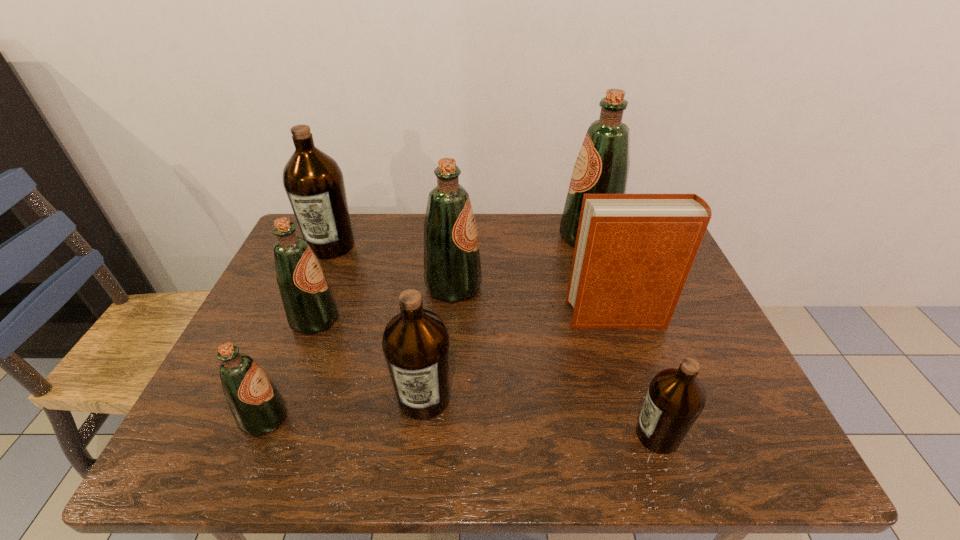
Identify the location of object that ranks as the fifth closest to the second biggest brown olive oil. (675, 398).

I want to click on object that is the sixth closest to the nearest green olive oil, so click(675, 398).

This screenshot has height=540, width=960. In order to click on olive oil that is the sixth closest to the rightmost green olive oil in this screenshot , I will do `click(258, 408)`.

Image resolution: width=960 pixels, height=540 pixels. What are the coordinates of `olive oil that is the sixth nearest to the farthest brown olive oil` in the screenshot? It's located at (675, 398).

This screenshot has width=960, height=540. I want to click on green olive oil that is the closest to the biggest brown olive oil, so click(309, 304).

Locate an element on the screen. the fourth closest green olive oil to the leftmost brown olive oil is located at coordinates point(602,166).

Find the location of `brown olive oil that stands as the second closest to the smallest brown olive oil`. brown olive oil that stands as the second closest to the smallest brown olive oil is located at coordinates (314, 183).

Identify which brown olive oil is located as the second nearest to the second brown olive oil from left to right. Please provide its 2D coordinates. Your answer should be formatted as a tuple, i.e. [(x, y)], where the tuple contains the x and y coordinates of a point satisfying the conditions above.

[(314, 183)]

The image size is (960, 540). I want to click on vacant space that satisfies the following two spatial constraints: 1. on the front-facing side of the tallest object; 2. on the label of the leftmost brown olive oil, so click(x=591, y=246).

At what (x,y) coordinates should I click in order to perform the action: click on free point that satisfies the following two spatial constraints: 1. on the open cover of the hardback book; 2. on the label of the second biggest brown olive oil. Please return your answer as a coordinate pair (x, y). Looking at the image, I should click on (643, 397).